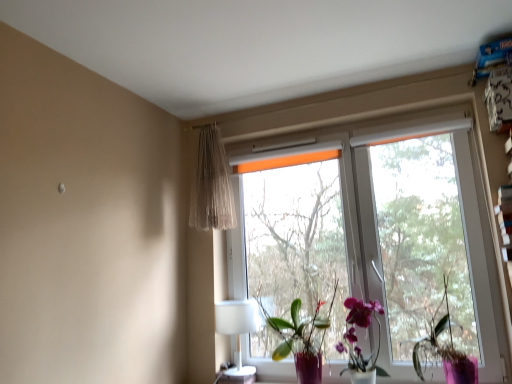
Question: From the image's perspective, relative to white plastic table lamp at lower center, is orange fabric tree at center above or below?

Choices:
 (A) above
 (B) below

Answer: (A)

Question: Do you think orange fabric tree at center is within white plastic table lamp at lower center, or outside of it?

Choices:
 (A) outside
 (B) inside

Answer: (A)

Question: Estimate the real-world distances between objects in this image. Which object is farther from the orange fabric tree at center?

Choices:
 (A) transparent glass window at center
 (B) translucent beige curtain at upper left
 (C) white plastic table lamp at lower center
 (D) purple glossy orchid at center, arranged as the 2th houseplant when viewed from the right
 (E) translucent glass vase with orchids at center

Answer: (B)

Question: Estimate the real-world distances between objects in this image. Which object is farther from the transparent glass window at center?

Choices:
 (A) purple glossy orchid at center, which ranks as the 1th houseplant in left-to-right order
 (B) white plastic table lamp at lower center
 (C) translucent glass vase with orchids at center
 (D) translucent beige curtain at upper left
 (E) purple matte plant at right, acting as the 2th houseplant starting from the left

Answer: (B)